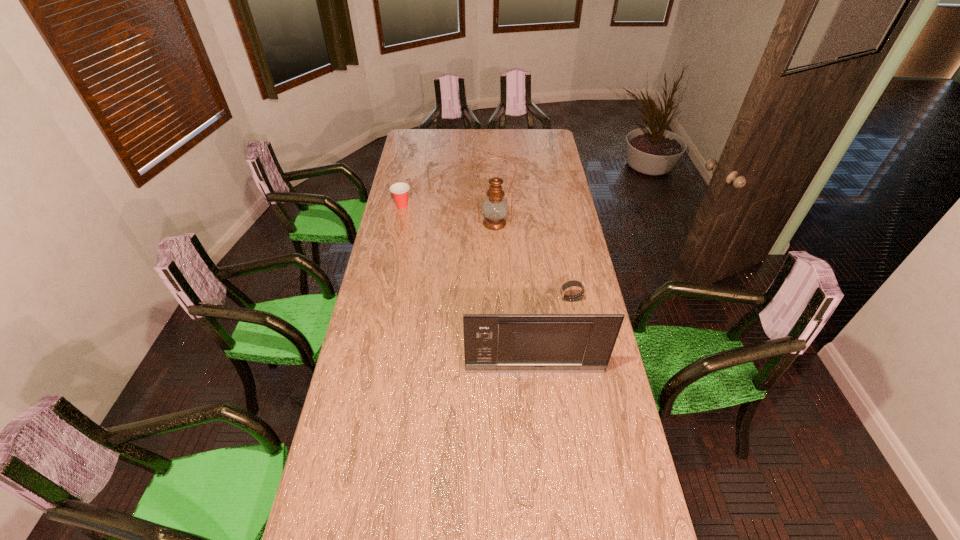
Locate an element on the screen. The image size is (960, 540). vacant space in between the third nearest object and the nearest object is located at coordinates (515, 297).

Where is `free area in between the watch and the third nearest object`? free area in between the watch and the third nearest object is located at coordinates (533, 261).

Where is `vacant space that's between the farthest object and the third farthest object`? The image size is (960, 540). vacant space that's between the farthest object and the third farthest object is located at coordinates (487, 252).

Locate which object ranks second in proximity to the oil lamp. Please provide its 2D coordinates. Your answer should be formatted as a tuple, i.e. [(x, y)], where the tuple contains the x and y coordinates of a point satisfying the conditions above.

[(572, 283)]

This screenshot has width=960, height=540. What are the coordinates of `the third closest object to the second farthest object` in the screenshot? It's located at (493, 343).

What are the coordinates of `blank area in the image that satisfies the following two spatial constraints: 1. on the face of the watch; 2. on the front panel of the microwave oven` in the screenshot? It's located at click(x=585, y=370).

Locate an element on the screen. Image resolution: width=960 pixels, height=540 pixels. vacant space that satisfies the following two spatial constraints: 1. on the face of the watch; 2. on the front panel of the microwave oven is located at coordinates (585, 370).

The width and height of the screenshot is (960, 540). In order to click on free spot that satisfies the following two spatial constraints: 1. on the front side of the second farthest object; 2. on the left side of the farthest object in this screenshot , I will do `click(398, 223)`.

This screenshot has height=540, width=960. Find the location of `free region that satisfies the following two spatial constraints: 1. on the front side of the second farthest object; 2. on the right side of the farthest object`. free region that satisfies the following two spatial constraints: 1. on the front side of the second farthest object; 2. on the right side of the farthest object is located at coordinates (398, 223).